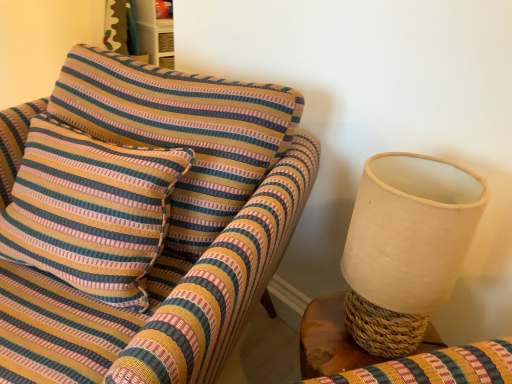
Question: Does white fabric lampshade at right have a smaller size compared to woven wood table at right?

Choices:
 (A) no
 (B) yes

Answer: (B)

Question: Is white fabric lampshade at right shorter than woven wood table at right?

Choices:
 (A) no
 (B) yes

Answer: (A)

Question: Is woven wood table at right a part of white fabric lampshade at right?

Choices:
 (A) no
 (B) yes

Answer: (A)

Question: Considering the relative sizes of white fabric lampshade at right and woven wood table at right in the image provided, is white fabric lampshade at right bigger than woven wood table at right?

Choices:
 (A) no
 (B) yes

Answer: (A)

Question: Is white fabric lampshade at right further to camera compared to woven wood table at right?

Choices:
 (A) yes
 (B) no

Answer: (B)

Question: Which is correct: white fabric lampshade at right is inside striped fabric pillow at left, or outside of it?

Choices:
 (A) outside
 (B) inside

Answer: (A)

Question: Is white fabric lampshade at right to the left or to the right of striped fabric pillow at left in the image?

Choices:
 (A) left
 (B) right

Answer: (B)

Question: Is white fabric lampshade at right wider or thinner than striped fabric pillow at left?

Choices:
 (A) wide
 (B) thin

Answer: (B)

Question: Considering the positions of white fabric lampshade at right and striped fabric pillow at left in the image, is white fabric lampshade at right taller or shorter than striped fabric pillow at left?

Choices:
 (A) short
 (B) tall

Answer: (A)

Question: Is striped fabric pillow at left wider or thinner than white fabric lampshade at right?

Choices:
 (A) wide
 (B) thin

Answer: (A)

Question: From the image's perspective, is striped fabric pillow at left positioned above or below white fabric lampshade at right?

Choices:
 (A) above
 (B) below

Answer: (A)

Question: From a real-world perspective, is striped fabric pillow at left positioned above or below white fabric lampshade at right?

Choices:
 (A) above
 (B) below

Answer: (B)

Question: Is point (2, 221) positioned closer to the camera than point (372, 175)?

Choices:
 (A) farther
 (B) closer

Answer: (A)

Question: Is white fabric lampshade at right in front of or behind woven wood table at right in the image?

Choices:
 (A) behind
 (B) front

Answer: (B)

Question: From a real-world perspective, is white fabric lampshade at right physically located above or below woven wood table at right?

Choices:
 (A) above
 (B) below

Answer: (A)